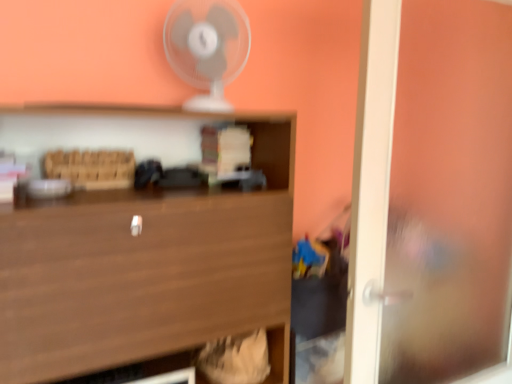
Question: In terms of height, does wooden at center look taller or shorter compared to transparent glass door at right?

Choices:
 (A) tall
 (B) short

Answer: (B)

Question: Is point (56, 347) closer or farther from the camera than point (354, 148)?

Choices:
 (A) farther
 (B) closer

Answer: (B)

Question: Estimate the real-world distances between objects in this image. Which object is closer to the transparent glass door at right?

Choices:
 (A) white plastic fan at upper center
 (B) wooden at center

Answer: (B)

Question: Estimate the real-world distances between objects in this image. Which object is closer to the transparent glass door at right?

Choices:
 (A) white plastic fan at upper center
 (B) wooden at center

Answer: (B)